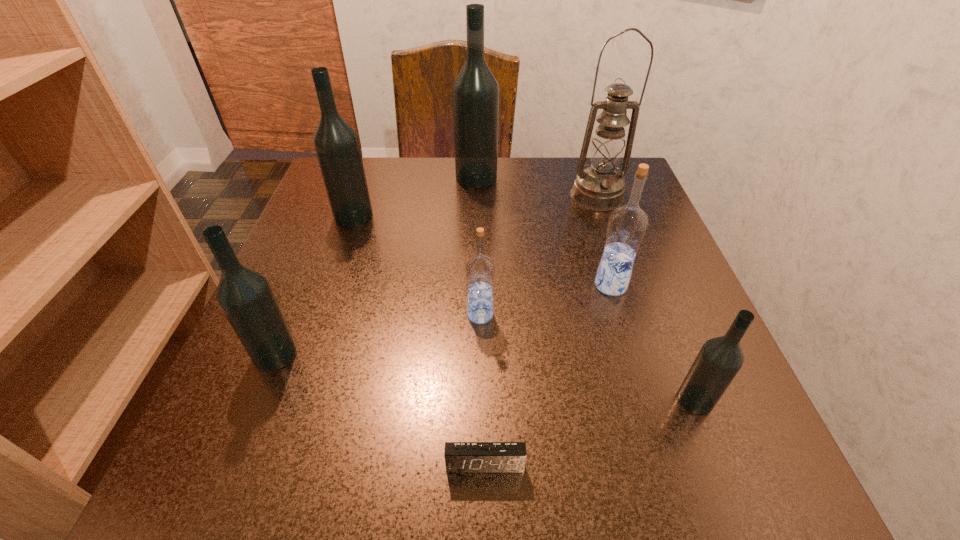
This screenshot has height=540, width=960. What are the coordinates of `blank space located 0.120m on the back of the smaller blue vodka` in the screenshot? It's located at (480, 258).

I want to click on vacant space located 0.080m on the back of the nearest vodka, so click(x=672, y=341).

The width and height of the screenshot is (960, 540). In order to click on oil lamp situated at the far edge in this screenshot , I will do `click(599, 187)`.

Image resolution: width=960 pixels, height=540 pixels. What are the coordinates of `object that is at the near edge` in the screenshot? It's located at (460, 457).

Locate an element on the screen. oil lamp located at the right edge is located at coordinates (599, 187).

The image size is (960, 540). In order to click on object present at the far left corner in this screenshot , I will do `click(336, 144)`.

Where is `object that is at the far right corner`? Image resolution: width=960 pixels, height=540 pixels. object that is at the far right corner is located at coordinates (599, 187).

Image resolution: width=960 pixels, height=540 pixels. Identify the location of vacant space at the far edge of the desktop. (403, 193).

Where is `free location at the near edge`? The width and height of the screenshot is (960, 540). free location at the near edge is located at coordinates (605, 480).

At what (x,y) coordinates should I click in order to perform the action: click on vacant position at the left edge of the desktop. Please return your answer as a coordinate pair (x, y). This screenshot has height=540, width=960. Looking at the image, I should click on tap(236, 395).